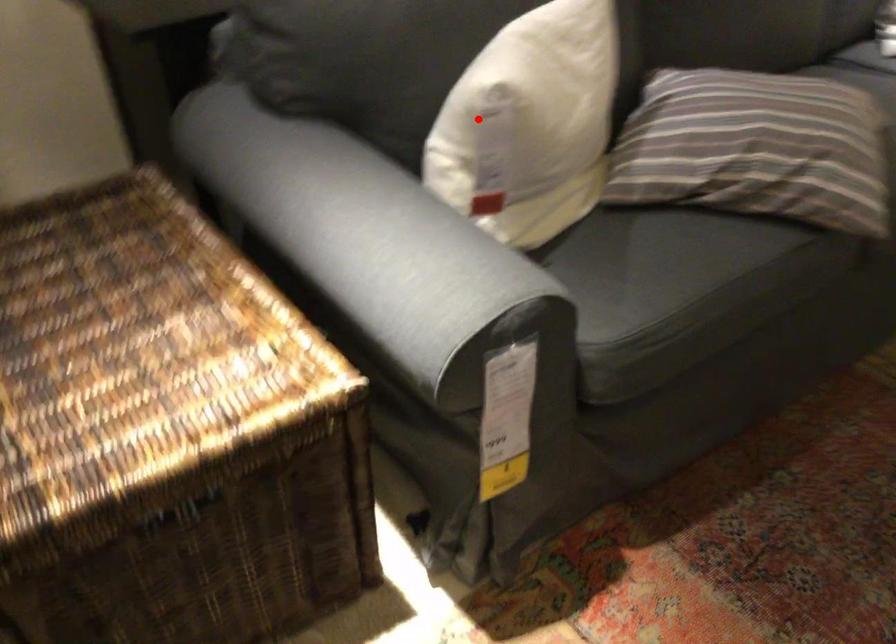
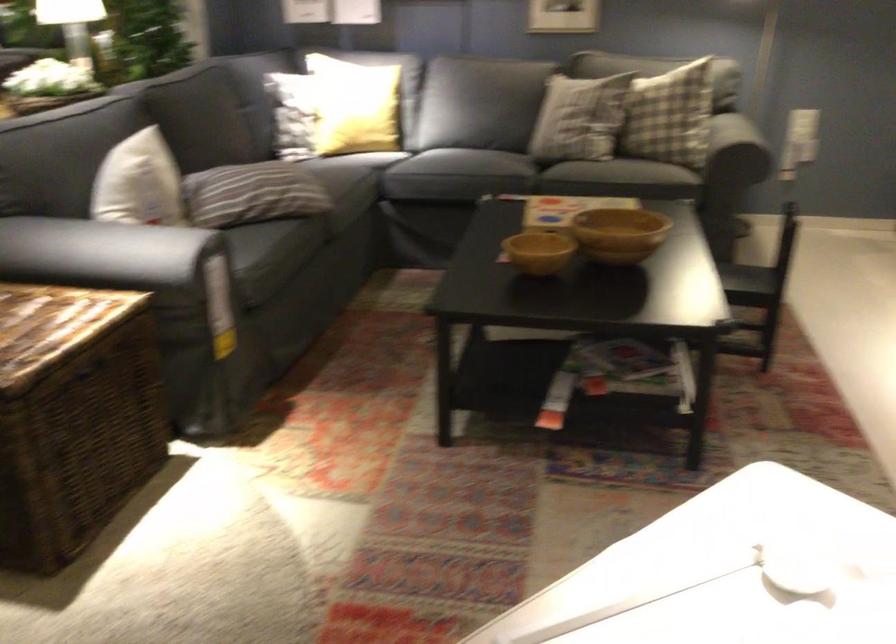
Locate, in the second image, the point that corresponds to the highlighted location in the first image.

(139, 183)